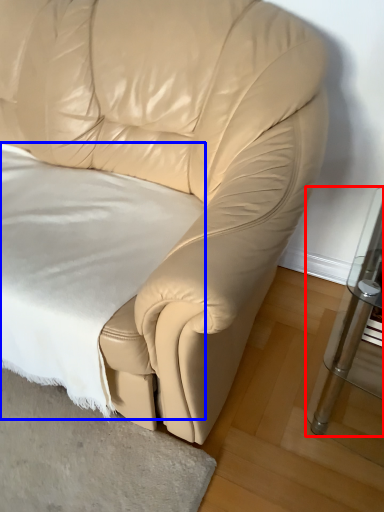
Question: Which object appears closest to the camera in this image, table (highlighted by a red box) or sheet (highlighted by a blue box)?

Choices:
 (A) table
 (B) sheet

Answer: (A)